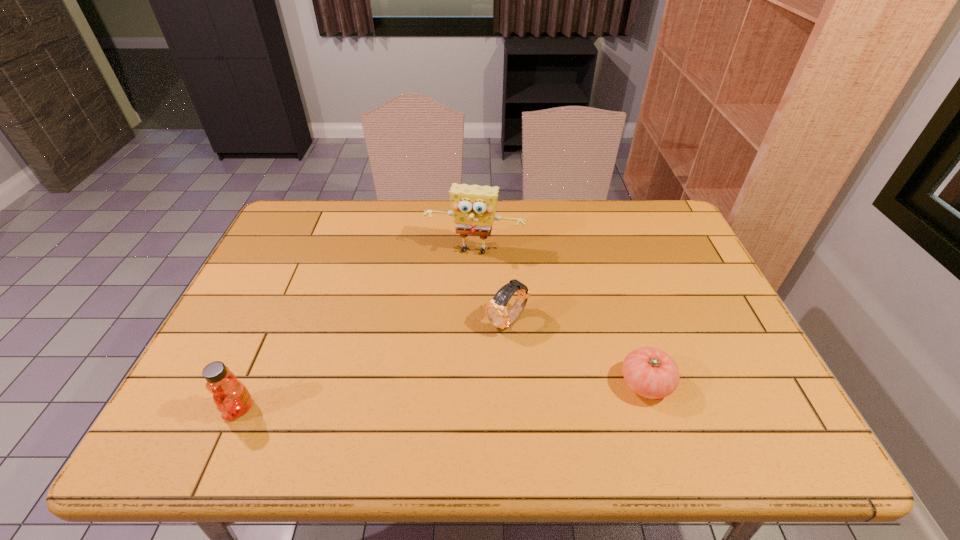
Locate an element on the screen. The height and width of the screenshot is (540, 960). honey is located at coordinates click(232, 398).

You are a GUI agent. You are given a task and a screenshot of the screen. Output one action in this format:
    pyautogui.click(x=<x>, y=<y>)
    Task: Click on the leftmost object
    
    Given the screenshot: What is the action you would take?
    pyautogui.click(x=232, y=398)

Locate an element on the screen. The height and width of the screenshot is (540, 960). the rightmost object is located at coordinates (652, 373).

Where is `the shortest object`? the shortest object is located at coordinates pyautogui.click(x=652, y=373).

In order to click on watch in this screenshot , I will do `click(496, 310)`.

Where is `the second farthest object`? the second farthest object is located at coordinates (496, 310).

Locate an element on the screen. The width and height of the screenshot is (960, 540). the tallest object is located at coordinates (473, 206).

At what (x,y) coordinates should I click in order to perform the action: click on the farthest object. Please return your answer as a coordinate pair (x, y). The image size is (960, 540). Looking at the image, I should click on (473, 206).

You are a GUI agent. You are given a task and a screenshot of the screen. Output one action in this format:
    pyautogui.click(x=<x>, y=<y>)
    Task: Click on the vacant space located 0.150m on the left of the tomato
    The height and width of the screenshot is (540, 960).
    Given the screenshot: What is the action you would take?
    pyautogui.click(x=554, y=383)

At what (x,y) coordinates should I click in order to perform the action: click on vacant space situated 0.140m on the face of the second farthest object. Please return your answer as a coordinate pair (x, y). The image size is (960, 540). Looking at the image, I should click on (454, 369).